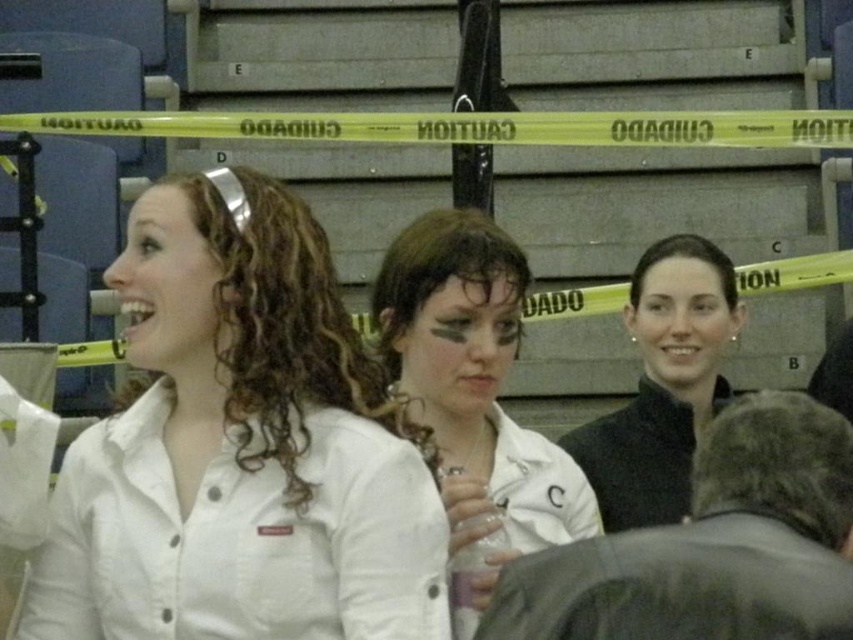
Consider the image. Which of these two, white matte shirt at upper left or black matte jacket at center, stands shorter?

Standing shorter between the two is black matte jacket at center.

Which is more to the left, white matte shirt at upper left or black matte jacket at center?

Positioned to the left is white matte shirt at upper left.

In order to click on white matte shirt at upper left in this screenshot , I will do `click(239, 449)`.

Who is higher up, white matte shirt at center or black matte jacket at center?

black matte jacket at center is higher up.

Who is taller, white matte shirt at center or black matte jacket at center?

Standing taller between the two is white matte shirt at center.

Is point (462, 371) positioned in front of point (653, 253)?

Yes, it is.

You are a GUI agent. You are given a task and a screenshot of the screen. Output one action in this format:
    pyautogui.click(x=<x>, y=<y>)
    Task: Click on the white matte shirt at center
    
    Given the screenshot: What is the action you would take?
    pyautogui.click(x=473, y=396)

Who is positioned more to the left, white matte shirt at upper left or white matte shirt at center?

white matte shirt at upper left

Is white matte shirt at upper left shorter than white matte shirt at center?

In fact, white matte shirt at upper left may be taller than white matte shirt at center.

Who is more distant from viewer, (366, 465) or (431, 321)?

The point (431, 321) is more distant.

Locate an element on the screen. This screenshot has width=853, height=640. white matte shirt at upper left is located at coordinates point(239,449).